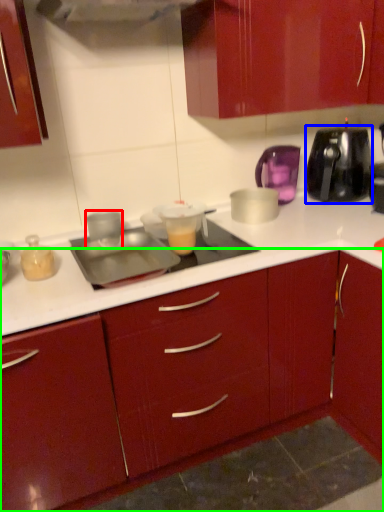
Question: Which is farther away from kitchen appliance (highlighted by a red box)? kitchen appliance (highlighted by a blue box) or cabinetry (highlighted by a green box)?

Choices:
 (A) kitchen appliance
 (B) cabinetry

Answer: (A)